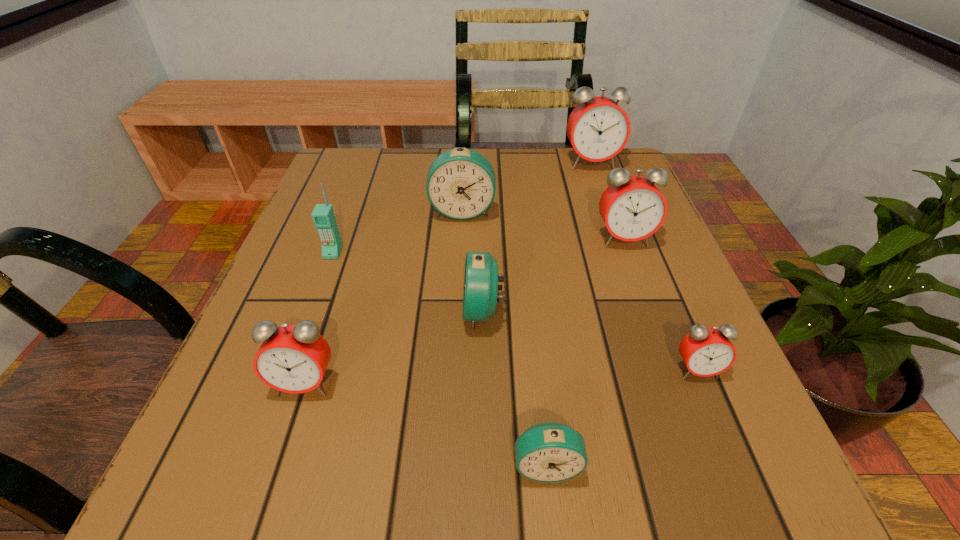
Where is `vacant area between the cellular telephone and the smallest blue alarm clock`? The image size is (960, 540). vacant area between the cellular telephone and the smallest blue alarm clock is located at coordinates (440, 359).

Where is `empty location between the cellular telephone and the nearest object`? empty location between the cellular telephone and the nearest object is located at coordinates (440, 359).

Where is `object identified as the second closest to the nearest blue alarm clock`? object identified as the second closest to the nearest blue alarm clock is located at coordinates (706, 351).

Locate an element on the screen. The height and width of the screenshot is (540, 960). object that stands as the closest to the smallest blue alarm clock is located at coordinates (480, 287).

Identify which alarm clock is the fourth closest to the smallest red alarm clock. Please provide its 2D coordinates. Your answer should be formatted as a tuple, i.e. [(x, y)], where the tuple contains the x and y coordinates of a point satisfying the conditions above.

[(461, 184)]

Choose which alarm clock is the nearest neighbor to the nearest object. Please provide its 2D coordinates. Your answer should be formatted as a tuple, i.e. [(x, y)], where the tuple contains the x and y coordinates of a point satisfying the conditions above.

[(480, 287)]

Identify the location of red alarm clock object that ranks as the third closest to the tallest alarm clock. (x=292, y=358).

Find the location of a particular element. the closest red alarm clock to the third biggest red alarm clock is located at coordinates (706, 351).

You are a GUI agent. You are given a task and a screenshot of the screen. Output one action in this format:
    pyautogui.click(x=<x>, y=<y>)
    Task: Click on the blue alarm clock that can be found as the second closest to the biggest red alarm clock
    The width and height of the screenshot is (960, 540).
    Given the screenshot: What is the action you would take?
    pyautogui.click(x=480, y=287)

Where is `blue alarm clock that is the closest to the nearest object`? blue alarm clock that is the closest to the nearest object is located at coordinates (480, 287).